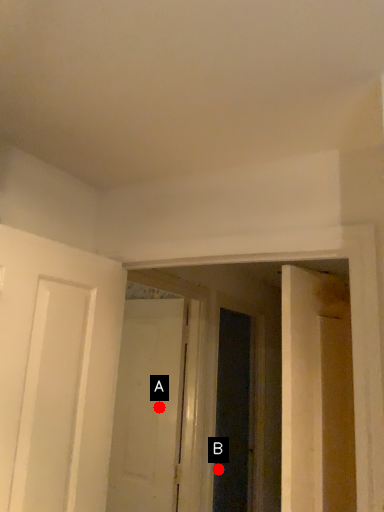
Question: Two points are circled on the image, labeled by A and B beside each circle. Which point appears closest to the camera in this image?

Choices:
 (A) A is closer
 (B) B is closer

Answer: (A)